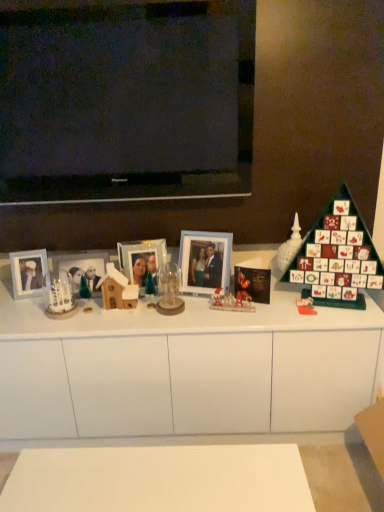
Where is `unoccupied space behind matte plastic toy at right, arranged as the first toy when viewed from the right`? unoccupied space behind matte plastic toy at right, arranged as the first toy when viewed from the right is located at coordinates (291, 296).